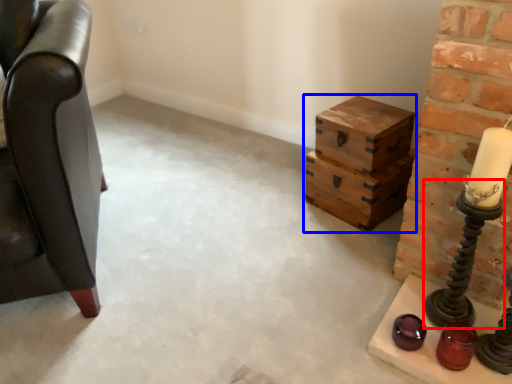
Question: Which of the following is the closest to the observer, candle holder (highlighted by a red box) or crate (highlighted by a blue box)?

Choices:
 (A) candle holder
 (B) crate

Answer: (A)